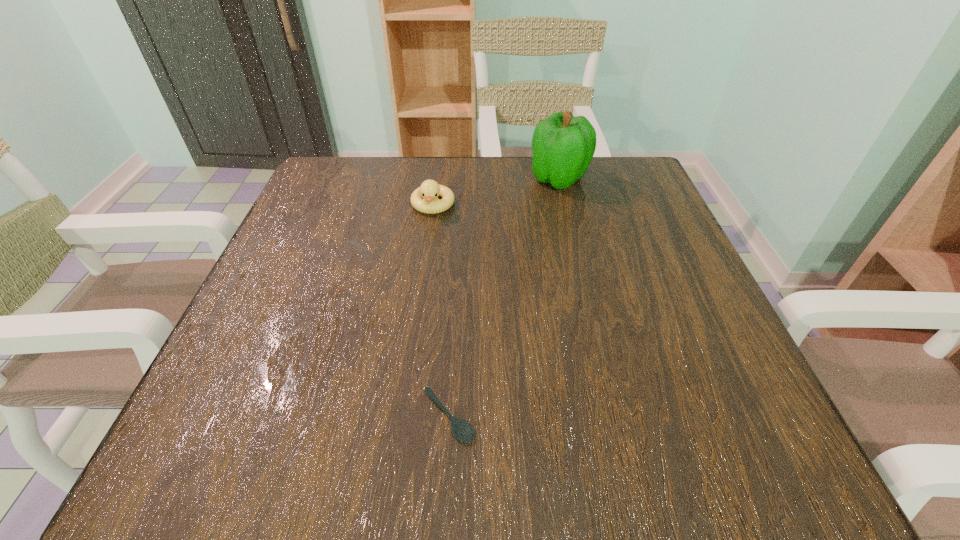
This screenshot has width=960, height=540. I want to click on the rightmost object, so click(x=563, y=146).

Image resolution: width=960 pixels, height=540 pixels. Find the location of `bell pepper`. bell pepper is located at coordinates (563, 146).

At what (x,y) coordinates should I click in order to perform the action: click on the second tallest object. Please return your answer as a coordinate pair (x, y). The image size is (960, 540). Looking at the image, I should click on (424, 199).

This screenshot has height=540, width=960. What are the coordinates of `the shortest object` in the screenshot? It's located at (462, 430).

Image resolution: width=960 pixels, height=540 pixels. Find the location of `the nearest object`. the nearest object is located at coordinates (462, 430).

At what (x,y) coordinates should I click in order to perform the action: click on free spot located 0.380m on the front of the tallest object. Please return your answer as a coordinate pair (x, y). Looking at the image, I should click on (594, 326).

At what (x,y) coordinates should I click in order to perform the action: click on vacant area situated 0.220m at the beak of the second tallest object. Please return your answer as a coordinate pair (x, y). This screenshot has width=960, height=540. Looking at the image, I should click on (420, 296).

The image size is (960, 540). In order to click on free space located on the left of the soupspoon in this screenshot , I will do `click(378, 416)`.

Locate an element on the screen. bell pepper located in the far edge section of the desktop is located at coordinates (563, 146).

What are the coordinates of `duckling situated at the far edge` in the screenshot? It's located at (424, 199).